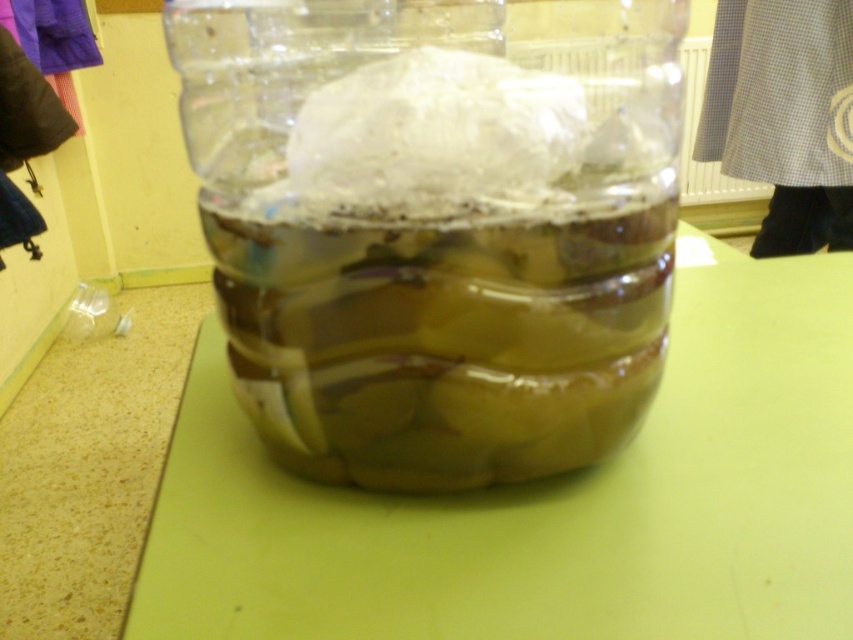
Question: Which point is closer to the camera?

Choices:
 (A) green matte table at center
 (B) transparent plastic jar at center

Answer: (A)

Question: Does transparent plastic jar at center have a larger size compared to green matte table at center?

Choices:
 (A) no
 (B) yes

Answer: (B)

Question: Does transparent plastic jar at center have a smaller size compared to green matte table at center?

Choices:
 (A) yes
 (B) no

Answer: (B)

Question: Can you confirm if transparent plastic jar at center is smaller than green matte table at center?

Choices:
 (A) yes
 (B) no

Answer: (B)

Question: Which point is closer to the camera taking this photo?

Choices:
 (A) (788, 490)
 (B) (260, 17)

Answer: (A)

Question: Which point appears closest to the camera in this image?

Choices:
 (A) (189, 548)
 (B) (364, 365)

Answer: (B)